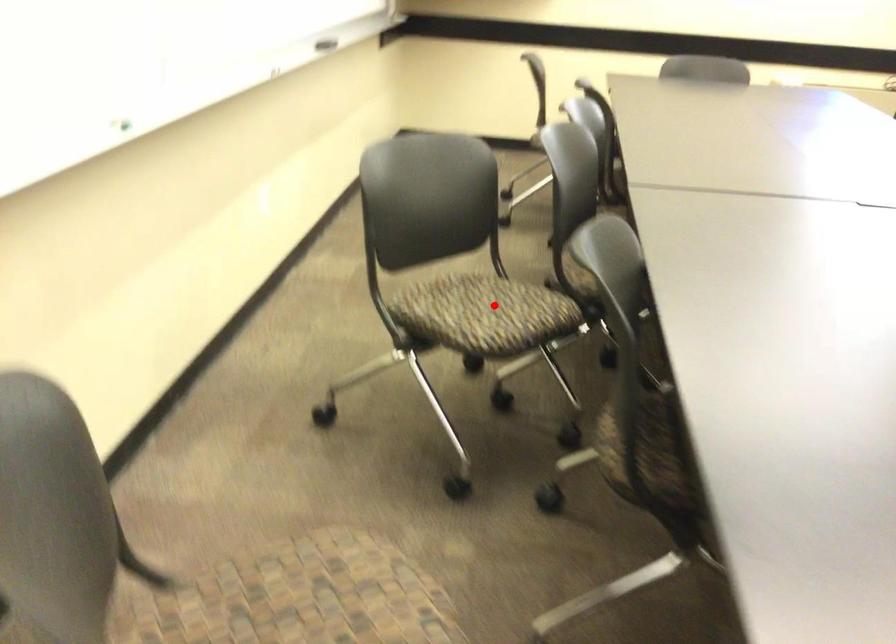
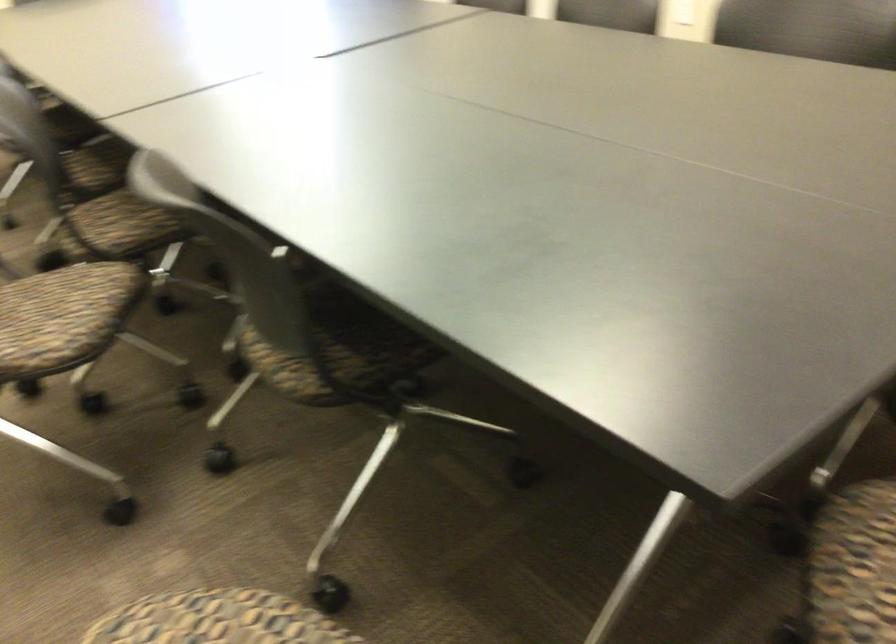
Question: I am providing you with two images of the same scene from different viewpoints. A red point is shown in image1. For the corresponding object point in image2, is it positioned nearer or farther from the camera?

Choices:
 (A) Nearer
 (B) Farther

Answer: (A)